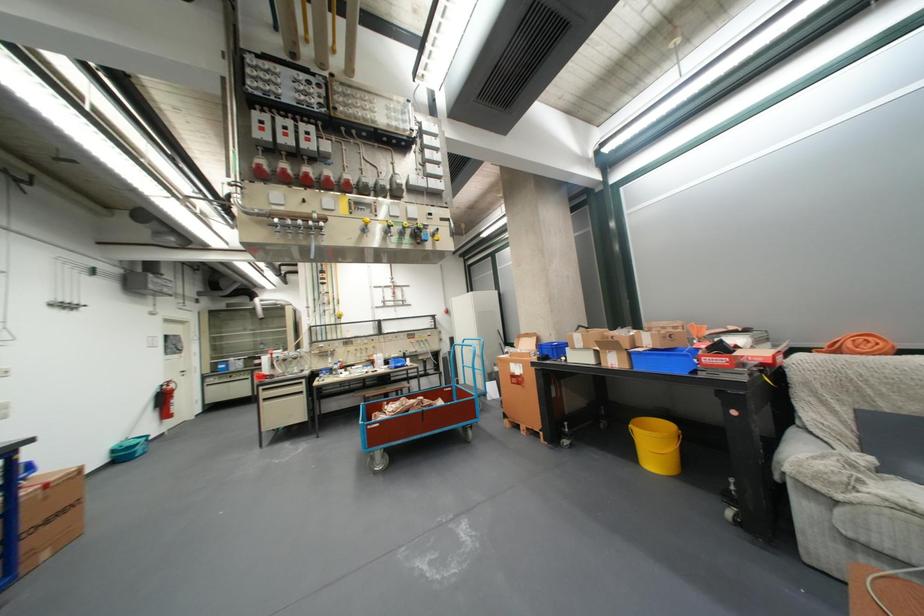
Locate an element on the screen. The image size is (924, 616). blue cart handle is located at coordinates (464, 361).